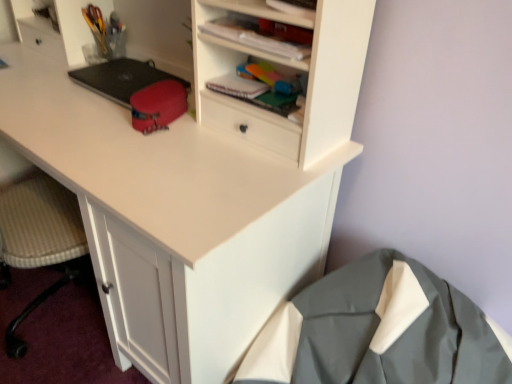
Where is `free space above black matte laptop at left (from a real-world perspective)`? The image size is (512, 384). free space above black matte laptop at left (from a real-world perspective) is located at coordinates (122, 72).